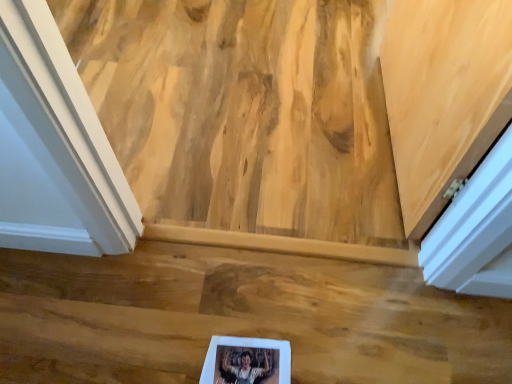
At what (x,y) coordinates should I click in order to perform the action: click on free space below wooden floor at center (from a real-world perspective). Please return your answer as a coordinate pair (x, y). The width and height of the screenshot is (512, 384). Looking at the image, I should click on (236, 309).